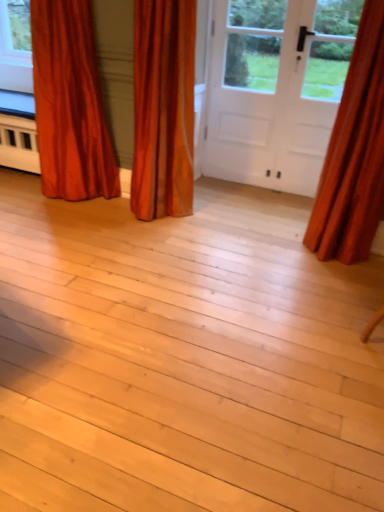
Question: From the image's perspective, is satin orange curtain at center, acting as the 2th curtain starting from the left, above velvet orange curtain at left, which appears as the third curtain when viewed from the right?

Choices:
 (A) no
 (B) yes

Answer: (A)

Question: Is satin orange curtain at center, the 2th curtain viewed from the right, bigger than velvet orange curtain at left, which appears as the third curtain when viewed from the right?

Choices:
 (A) no
 (B) yes

Answer: (A)

Question: Is satin orange curtain at center, the 2th curtain viewed from the right, with velvet orange curtain at left, marked as the first curtain in a left-to-right arrangement?

Choices:
 (A) yes
 (B) no

Answer: (B)

Question: Does satin orange curtain at center, acting as the 2th curtain starting from the left, have a smaller size compared to velvet orange curtain at left, marked as the first curtain in a left-to-right arrangement?

Choices:
 (A) yes
 (B) no

Answer: (A)

Question: Are satin orange curtain at center, acting as the 2th curtain starting from the left, and velvet orange curtain at left, which appears as the third curtain when viewed from the right, far apart?

Choices:
 (A) no
 (B) yes

Answer: (A)

Question: From the image's perspective, is satin orange curtain at center, acting as the 2th curtain starting from the left, located beneath velvet orange curtain at left, which appears as the third curtain when viewed from the right?

Choices:
 (A) no
 (B) yes

Answer: (B)

Question: Does satin orange curtain at center, the 2th curtain viewed from the right, appear on the right side of white matte door at center?

Choices:
 (A) no
 (B) yes

Answer: (A)

Question: Is satin orange curtain at center, acting as the 2th curtain starting from the left, closer to the viewer compared to white matte door at center?

Choices:
 (A) no
 (B) yes

Answer: (B)

Question: Does satin orange curtain at center, acting as the 2th curtain starting from the left, appear on the left side of white matte door at center?

Choices:
 (A) no
 (B) yes

Answer: (B)

Question: Considering the relative sizes of satin orange curtain at center, the 2th curtain viewed from the right, and white matte door at center in the image provided, is satin orange curtain at center, the 2th curtain viewed from the right, smaller than white matte door at center?

Choices:
 (A) no
 (B) yes

Answer: (A)

Question: Is the position of satin orange curtain at center, the 2th curtain viewed from the right, more distant than that of white matte door at center?

Choices:
 (A) no
 (B) yes

Answer: (A)

Question: Is the surface of satin orange curtain at center, the 2th curtain viewed from the right, in direct contact with white matte door at center?

Choices:
 (A) yes
 (B) no

Answer: (B)

Question: Does satin orange curtain at right, which is the third curtain from left to right, have a greater height compared to white matte door at center?

Choices:
 (A) yes
 (B) no

Answer: (A)